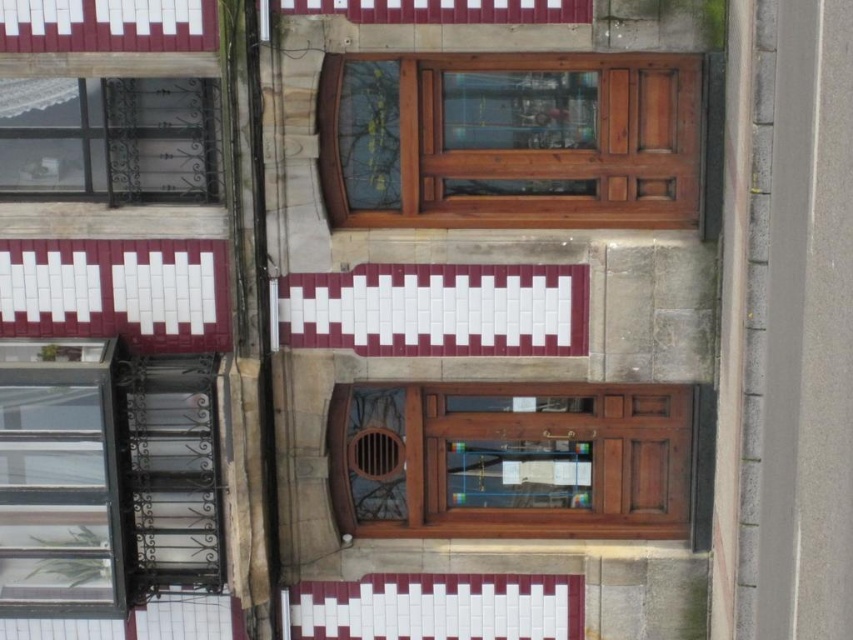
You are a painter who needs to know which object requires more vertical space for a mural. Based on the scene, which is taller between the wooden door at center and the metallic wrought iron window at upper left?

The wooden door at center is much taller than the metallic wrought iron window at upper left, so it requires more vertical space for the mural.

You are an architect designing a new building and want to ensure proper spacing between the clear glass window at lower left and the metallic wrought iron window at upper left. Based on the image, which window has a smaller width?

The clear glass window at lower left has a lesser width compared to the metallic wrought iron window at upper left, so the clear glass window at lower left is smaller in width.